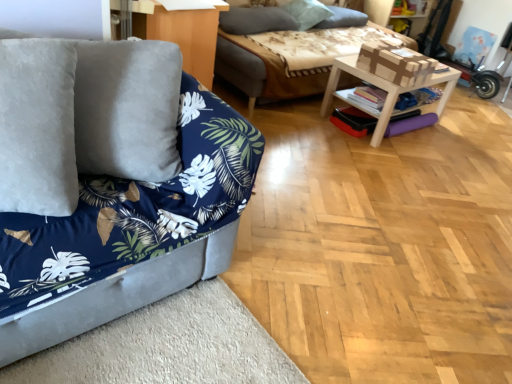
This screenshot has height=384, width=512. What do you see at coordinates (111, 187) in the screenshot?
I see `velvet blue couch at left, marked as the first studio couch in a front-to-back arrangement` at bounding box center [111, 187].

Measure the distance between velvet blue couch at left, which ranks as the 1th studio couch in bottom-to-top order, and camera.

They are 1.16 meters apart.

The height and width of the screenshot is (384, 512). Describe the element at coordinates (307, 12) in the screenshot. I see `gray soft pillow at upper center, which is the 2th pillow from right to left` at that location.

What is the approximate width of soft gray pillow at upper center, which is the third pillow from left to right?

The width of soft gray pillow at upper center, which is the third pillow from left to right, is 12.83 inches.

Describe the element at coordinates (383, 89) in the screenshot. I see `wooden table at center` at that location.

Measure the distance between point (289,27) and camera.

The distance of point (289,27) from camera is 3.62 meters.

Identify the location of velvet blue couch at left, which ranks as the 1th studio couch in bottom-to-top order. (x=111, y=187).

Is gray soft pillow at upper center, which is the second pillow from left to right, a part of velvet blue couch at left, the 2th studio couch positioned from the top?

No, gray soft pillow at upper center, which is the second pillow from left to right, is not a part of velvet blue couch at left, the 2th studio couch positioned from the top.

Is velvet blue couch at left, which appears as the second studio couch when viewed from the back, oriented away from gray soft pillow at upper center, which is the 2th pillow from right to left?

No, velvet blue couch at left, which appears as the second studio couch when viewed from the back, is not facing the opposite direction of gray soft pillow at upper center, which is the 2th pillow from right to left.

Starting from the gray soft pillow at upper center, which is the 2th pillow from right to left, which studio couch is the 2nd one in front? Please provide its 2D coordinates.

[(111, 187)]

Between point (140, 188) and point (298, 4), which one is positioned behind?

The point (298, 4) is farther from the camera.

Between matte wood dresser at upper center and soft gray pillow at upper center, acting as the first pillow starting from the right, which one has smaller size?

Smaller between the two is soft gray pillow at upper center, acting as the first pillow starting from the right.

Is matte wood dresser at upper center wider than soft gray pillow at upper center, acting as the first pillow starting from the right?

Yes.

From the image's perspective, would you say matte wood dresser at upper center is shown under soft gray pillow at upper center, which is the third pillow from left to right?

Yes.

How different are the orientations of matte wood dresser at upper center and soft gray pillow at upper center, which is the third pillow from left to right, in degrees?

matte wood dresser at upper center and soft gray pillow at upper center, which is the third pillow from left to right, are facing 87.9 degrees away from each other.

Based on the photo, considering the sizes of objects wooden table at center and wooden studio couch at upper center, which appears as the 2th studio couch when ordered from the bottom, in the image provided, who is smaller, wooden table at center or wooden studio couch at upper center, which appears as the 2th studio couch when ordered from the bottom,?

Smaller between the two is wooden table at center.

Is the depth of wooden table at center less than that of wooden studio couch at upper center, the 2th studio couch in the front-to-back sequence?

No, it is behind wooden studio couch at upper center, the 2th studio couch in the front-to-back sequence.

From the image's perspective, is wooden table at center on top of wooden studio couch at upper center, acting as the 1th studio couch starting from the top?

No, from the image's perspective, wooden table at center is not above wooden studio couch at upper center, acting as the 1th studio couch starting from the top.

Does point (373, 146) come behind point (295, 82)?

No, (373, 146) is closer to viewer.

Which of these two, gray soft pillow at upper center, the third pillow when ordered from right to left, or matte wood dresser at upper center, is bigger?

Bigger between the two is matte wood dresser at upper center.

Relative to matte wood dresser at upper center, is gray soft pillow at upper center, which is counted as the 1th pillow, starting from the left, in front or behind?

Visually, gray soft pillow at upper center, which is counted as the 1th pillow, starting from the left, is located behind matte wood dresser at upper center.

From the picture: Could you measure the distance between gray soft pillow at upper center, which is counted as the 1th pillow, starting from the left, and matte wood dresser at upper center?

gray soft pillow at upper center, which is counted as the 1th pillow, starting from the left, and matte wood dresser at upper center are 36.70 inches apart from each other.

From the image's perspective, is gray soft pillow at upper center, the third pillow when ordered from right to left, located beneath matte wood dresser at upper center?

Actually, gray soft pillow at upper center, the third pillow when ordered from right to left, appears above matte wood dresser at upper center in the image.

Is gray soft pillow at upper center, the third pillow when ordered from right to left, to the left of velvet blue couch at left, which ranks as the 1th studio couch in bottom-to-top order, from the viewer's perspective?

No, gray soft pillow at upper center, the third pillow when ordered from right to left, is not to the left of velvet blue couch at left, which ranks as the 1th studio couch in bottom-to-top order.

Identify the location of pillow that is the 2nd one above the velvet blue couch at left, marked as the first studio couch in a front-to-back arrangement (from a real-world perspective). This screenshot has height=384, width=512. (256, 20).

Does gray soft pillow at upper center, the third pillow when ordered from right to left, turn towards velvet blue couch at left, the 2th studio couch positioned from the top?

No, gray soft pillow at upper center, the third pillow when ordered from right to left, is not oriented towards velvet blue couch at left, the 2th studio couch positioned from the top.

Can you confirm if gray soft pillow at upper center, the third pillow when ordered from right to left, is smaller than velvet blue couch at left, which appears as the second studio couch when viewed from the back?

Indeed, gray soft pillow at upper center, the third pillow when ordered from right to left, has a smaller size compared to velvet blue couch at left, which appears as the second studio couch when viewed from the back.

Between gray soft pillow at upper center, which is the second pillow from left to right, and gray soft pillow at upper center, which is counted as the 1th pillow, starting from the left, which one is positioned in front?

Positioned in front is gray soft pillow at upper center, which is counted as the 1th pillow, starting from the left.

Considering the sizes of objects gray soft pillow at upper center, which is the 2th pillow from right to left, and gray soft pillow at upper center, which is counted as the 1th pillow, starting from the left, in the image provided, who is bigger, gray soft pillow at upper center, which is the 2th pillow from right to left, or gray soft pillow at upper center, which is counted as the 1th pillow, starting from the left,?

With larger size is gray soft pillow at upper center, which is the 2th pillow from right to left.

Does point (312, 5) come behind point (226, 15)?

Yes, point (312, 5) is behind point (226, 15).

Is soft gray pillow at upper center, acting as the first pillow starting from the right, in front of gray soft pillow at upper center, which is the 2th pillow from right to left?

No, the depth of soft gray pillow at upper center, acting as the first pillow starting from the right, is greater than that of gray soft pillow at upper center, which is the 2th pillow from right to left.

In the scene shown: Is soft gray pillow at upper center, acting as the first pillow starting from the right, facing towards gray soft pillow at upper center, which is the second pillow from left to right?

No, soft gray pillow at upper center, acting as the first pillow starting from the right, is not oriented towards gray soft pillow at upper center, which is the second pillow from left to right.

Consider the image. Does soft gray pillow at upper center, acting as the first pillow starting from the right, have a greater height compared to gray soft pillow at upper center, which is the 2th pillow from right to left?

Incorrect, the height of soft gray pillow at upper center, acting as the first pillow starting from the right, is not larger of that of gray soft pillow at upper center, which is the 2th pillow from right to left.

Starting from the gray soft pillow at upper center, which is the second pillow from left to right, which studio couch is the 2nd one in front? Please provide its 2D coordinates.

[(111, 187)]

Where is `dresser above the soft gray pillow at upper center, acting as the first pillow starting from the right (from a real-world perspective)`? The image size is (512, 384). dresser above the soft gray pillow at upper center, acting as the first pillow starting from the right (from a real-world perspective) is located at coordinates (182, 33).

Based on their spatial positions, is gray soft pillow at upper center, which is counted as the 1th pillow, starting from the left, or gray soft pillow at upper center, which is the second pillow from left to right, further from matte wood dresser at upper center?

Based on the image, gray soft pillow at upper center, which is the second pillow from left to right, appears to be further to matte wood dresser at upper center.

Estimate the real-world distances between objects in this image. Which object is further from wooden table at center, gray soft pillow at upper center, which is the 2th pillow from right to left, or matte wood dresser at upper center?

Based on the image, matte wood dresser at upper center appears to be further to wooden table at center.

When comparing their distances from gray soft pillow at upper center, the third pillow when ordered from right to left, does wooden table at center or wooden studio couch at upper center, acting as the 1th studio couch starting from the top, seem further?

Based on the image, wooden table at center appears to be further to gray soft pillow at upper center, the third pillow when ordered from right to left.

Considering their positions, is wooden studio couch at upper center, marked as the first studio couch in a back-to-front arrangement, positioned closer to velvet blue couch at left, which appears as the second studio couch when viewed from the back, than wooden table at center?

Among the two, wooden studio couch at upper center, marked as the first studio couch in a back-to-front arrangement, is located nearer to velvet blue couch at left, which appears as the second studio couch when viewed from the back.

Which object lies nearer to the anchor point matte wood dresser at upper center, velvet blue couch at left, the 2th studio couch positioned from the top, or soft gray pillow at upper center, which is the third pillow from left to right?

Among the two, velvet blue couch at left, the 2th studio couch positioned from the top, is located nearer to matte wood dresser at upper center.

Estimate the real-world distances between objects in this image. Which object is closer to soft gray pillow at upper center, which is the third pillow from left to right, wooden table at center or velvet blue couch at left, the 2th studio couch positioned from the top?

Based on the image, wooden table at center appears to be nearer to soft gray pillow at upper center, which is the third pillow from left to right.

Estimate the real-world distances between objects in this image. Which object is closer to velvet blue couch at left, the 2th studio couch positioned from the top, gray soft pillow at upper center, which is the 2th pillow from right to left, or gray soft pillow at upper center, which is counted as the 1th pillow, starting from the left?

gray soft pillow at upper center, which is counted as the 1th pillow, starting from the left.

Considering their positions, is velvet blue couch at left, which appears as the second studio couch when viewed from the back, positioned further to gray soft pillow at upper center, which is counted as the 1th pillow, starting from the left, than soft gray pillow at upper center, acting as the first pillow starting from the right?

Among the two, velvet blue couch at left, which appears as the second studio couch when viewed from the back, is located further to gray soft pillow at upper center, which is counted as the 1th pillow, starting from the left.

Find the location of a particular element. pillow situated between gray soft pillow at upper center, the third pillow when ordered from right to left, and soft gray pillow at upper center, acting as the first pillow starting from the right, from left to right is located at coordinates (307, 12).

What are the coordinates of `pillow between wooden studio couch at upper center, the 2th studio couch in the front-to-back sequence, and gray soft pillow at upper center, which is the second pillow from left to right, along the z-axis` in the screenshot? It's located at (256, 20).

Where is `pillow positioned between velvet blue couch at left, which appears as the second studio couch when viewed from the back, and gray soft pillow at upper center, which is the 2th pillow from right to left, from near to far`? Image resolution: width=512 pixels, height=384 pixels. pillow positioned between velvet blue couch at left, which appears as the second studio couch when viewed from the back, and gray soft pillow at upper center, which is the 2th pillow from right to left, from near to far is located at coordinates (256, 20).

You are a GUI agent. You are given a task and a screenshot of the screen. Output one action in this format:
    pyautogui.click(x=<x>, y=<y>)
    Task: Click on the table between wooden studio couch at upper center, marked as the first studio couch in a back-to-front arrangement, and gray soft pillow at upper center, which is the second pillow from left to right, from front to back
    
    Given the screenshot: What is the action you would take?
    pyautogui.click(x=383, y=89)